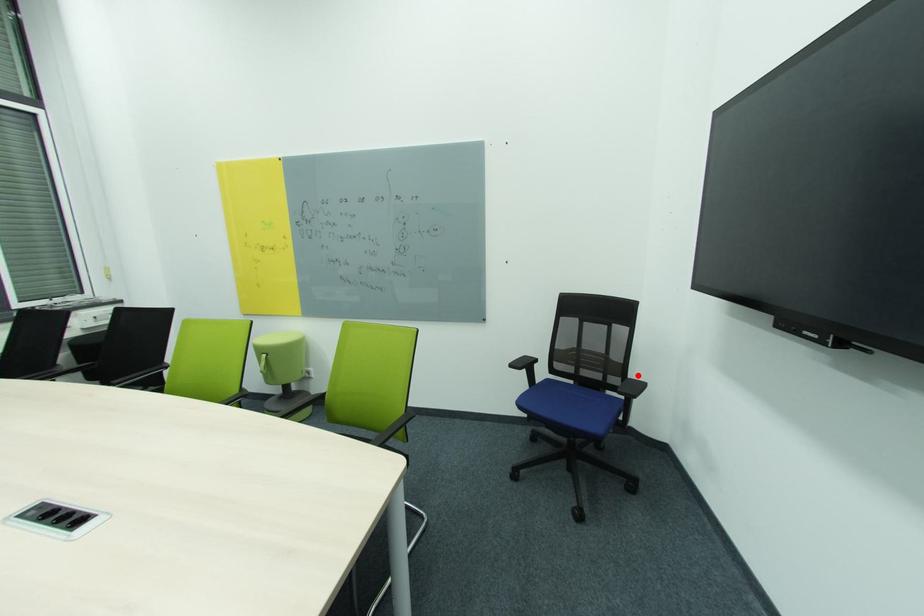
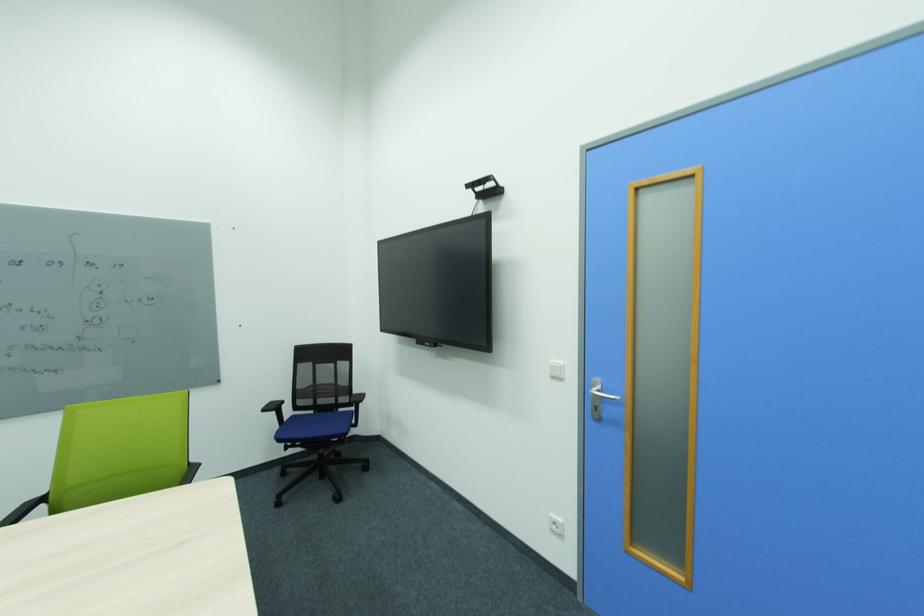
Question: I am providing you with two images of the same scene from different viewpoints. A red point is shown in image1. For the corresponding object point in image2, is it positioned nearer or farther from the camera?

Choices:
 (A) Nearer
 (B) Farther

Answer: (A)